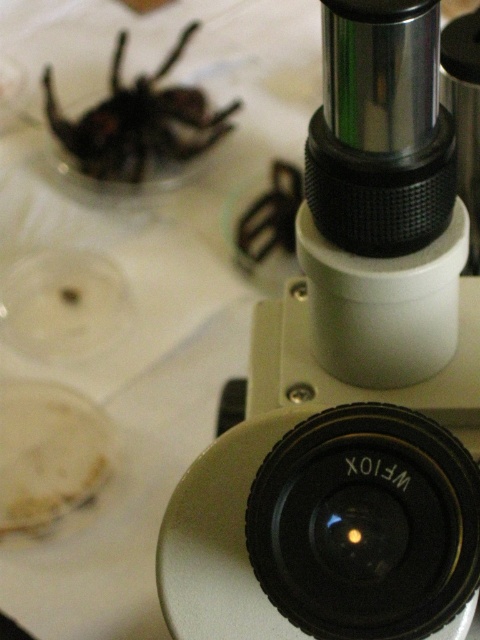
You are observing a microscope setup with two points marked in the image. The first point is at coordinates point (321, 628) and the second is at point (239, 100). From your perspective, which point is closer to you?

Point (321, 628) is in front of point (239, 100), so it is closer to you.

You are a student trying to observe the shiny black spider at upper left under the microscope. The microscope has a black plastic lens at center. Can you see the spider clearly through the lens?

The black plastic lens at center is in front of the shiny black spider at upper left, so the spider is obstructed by the lens and cannot be seen clearly through it.

You are a student trying to observe the shiny black spider at upper left using the microscope. The black plastic lens at center is blocking your view. Can you move the microscope to see the spider clearly?

The black plastic lens at center is positioned under the shiny black spider at upper left. Moving the microscope could allow you to reposition the black plastic lens at center so it no longer blocks the view of the shiny black spider at upper left, enabling clear observation.